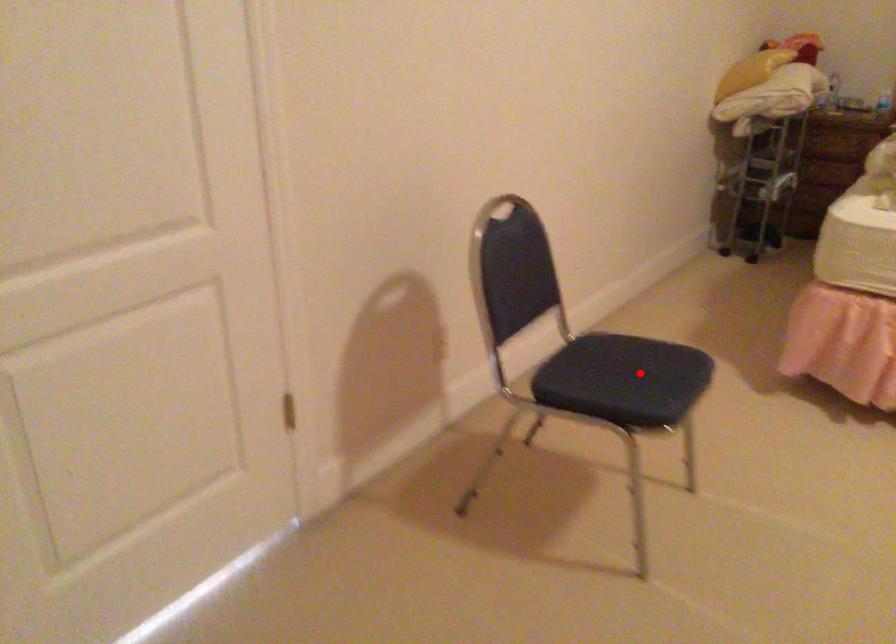
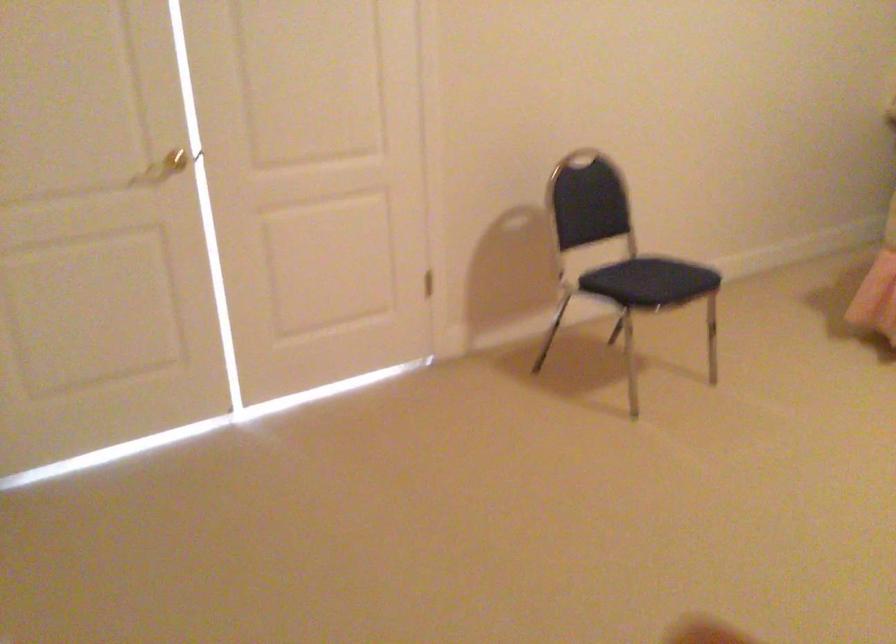
Question: A red point is marked in image1. In image2, is the corresponding 3D point closer to the camera or farther? Reply with the corresponding letter.

Choices:
 (A) The corresponding 3D point is closer.
 (B) The corresponding 3D point is farther.

Answer: (B)